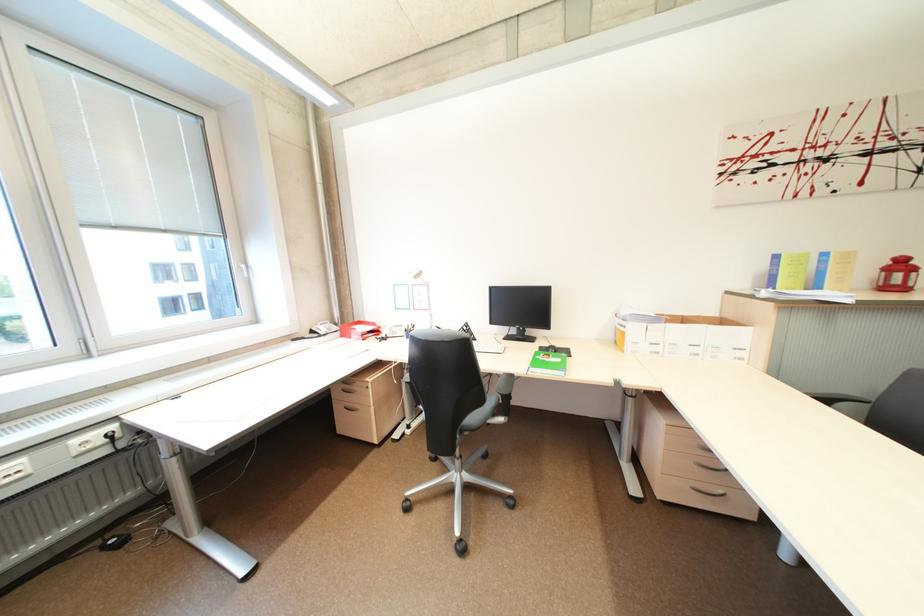
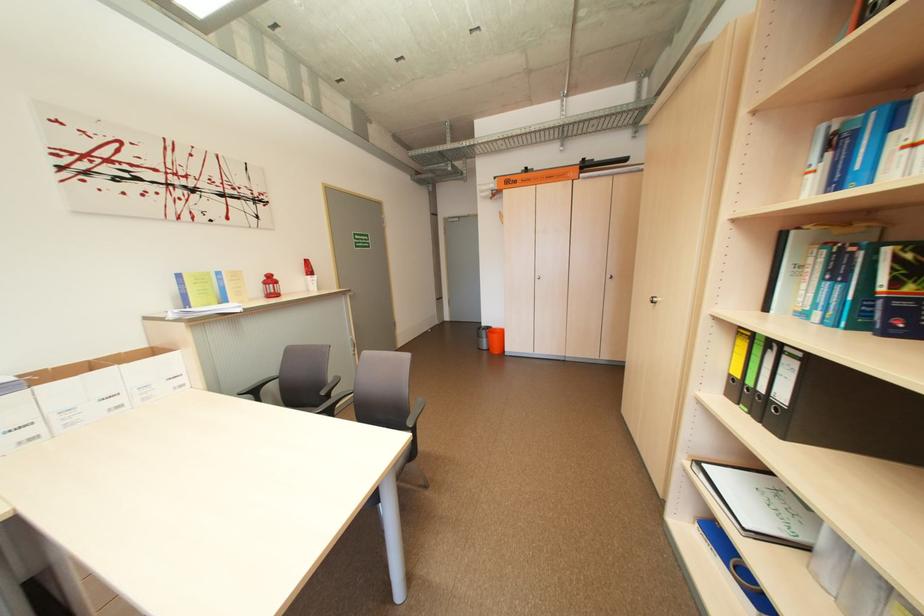
Find the pixel in the second image that matches [732,323] in the first image.

(163, 353)